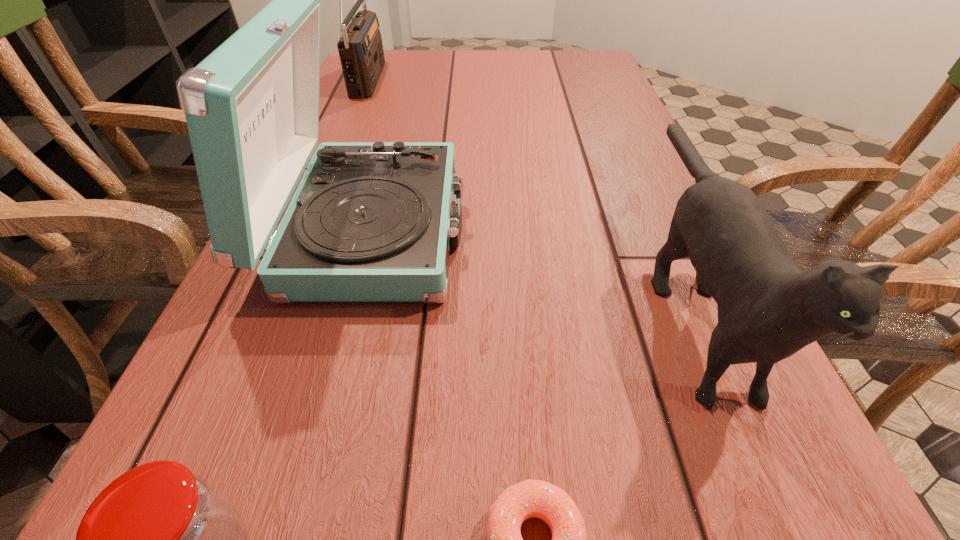
At what (x,y) coordinates should I click in order to perform the action: click on object at the right edge. Please return your answer as a coordinate pair (x, y). Looking at the image, I should click on (768, 309).

Identify the location of object present at the far left corner. This screenshot has width=960, height=540. (360, 47).

I want to click on vacant space at the far edge, so click(447, 80).

Identify the location of vacant point at the left edge. point(366,112).

I want to click on vacant area at the right edge of the desktop, so click(664, 199).

Locate an element on the screen. vacant space at the far left corner of the desktop is located at coordinates coord(387,57).

The image size is (960, 540). Find the location of `vacant point located between the farthest object and the cat`. vacant point located between the farthest object and the cat is located at coordinates (528, 187).

Find the location of a particular element. The image size is (960, 540). object that ranks as the fourth closest to the record player is located at coordinates (360, 47).

Where is `the fourth closest object relative to the radio receiver`? This screenshot has width=960, height=540. the fourth closest object relative to the radio receiver is located at coordinates (530, 498).